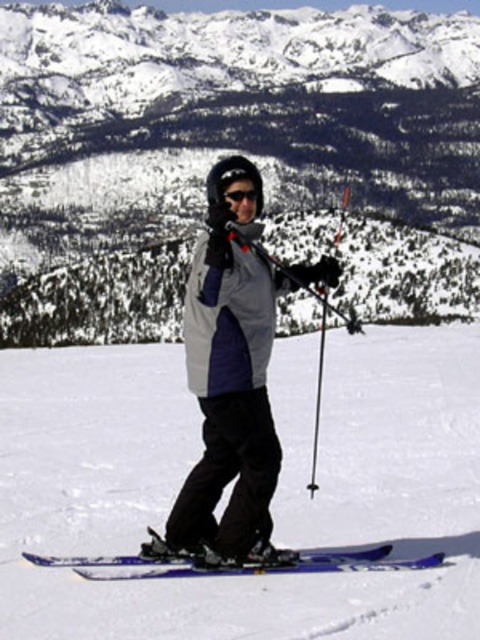
Based on the photo, you are a drone operator trying to capture the skier in the image. The skier is at point (274, 497). You want to fly the drone to the highest peak in the background mountains. Which direction should you fly the drone relative to the skier?

The highest peak in the background mountains is located to the upper left of the skier at point 0.771, 0.571. To fly the drone towards it, you should direct it in that direction.

Consider the image. You are a photographer planning to take a photo of the white snow mountain at center and the blue metallic skis at lower center. Which object will appear larger in the photo?

The white snow mountain at center will appear larger in the photo because it is much taller than the blue metallic skis at lower center.

You are a photographer planning to take a photo of the white snow mountain at center and the blue metallic skis at lower center. Based on their positions, which object should you focus on first to ensure it appears sharp in the foreground?

The blue metallic skis at lower center should be focused on first because they are in the foreground and closer to the camera compared to the white snow mountain at center, which is further away.